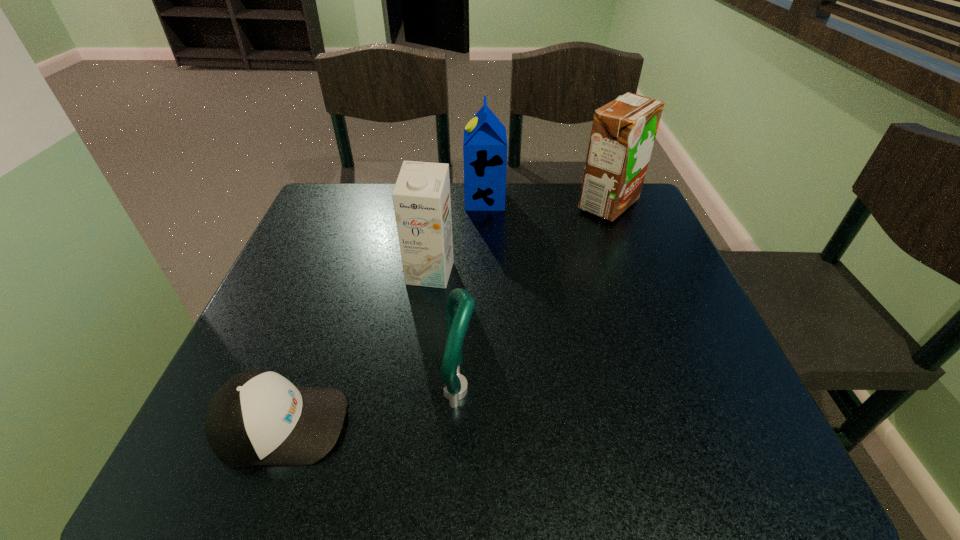
At what (x,y) coordinates should I click in order to perform the action: click on empty space between the second carton from right to left and the nearest carton. Please return your answer as a coordinate pair (x, y). The image size is (960, 540). Looking at the image, I should click on (457, 237).

Image resolution: width=960 pixels, height=540 pixels. I want to click on vacant space that is in between the leftmost object and the rightmost carton, so click(x=444, y=314).

Where is `free space that is in between the rightmost object and the cap`? The width and height of the screenshot is (960, 540). free space that is in between the rightmost object and the cap is located at coordinates (x=444, y=314).

Find the location of a particular element. This screenshot has height=540, width=960. free spot between the bottle opener and the shortest object is located at coordinates (371, 407).

The height and width of the screenshot is (540, 960). I want to click on unoccupied position between the third farthest object and the second carton from right to left, so click(x=457, y=237).

Where is `vacant point located between the bottle opener and the nearest carton`? vacant point located between the bottle opener and the nearest carton is located at coordinates (445, 332).

At what (x,y) coordinates should I click in order to perform the action: click on free space that is in between the leftmost carton and the rightmost carton. Please return your answer as a coordinate pair (x, y). The image size is (960, 540). Looking at the image, I should click on (519, 239).

At what (x,y) coordinates should I click in order to perform the action: click on unoccupied position between the second carton from left to right and the cap. Please return your answer as a coordinate pair (x, y). The image size is (960, 540). Looking at the image, I should click on (383, 312).

Find the location of a particular element. empty space between the rightmost object and the second carton from left to right is located at coordinates (546, 202).

At what (x,y) coordinates should I click in order to perform the action: click on object that can be found as the fourth closest to the cap. Please return your answer as a coordinate pair (x, y). The width and height of the screenshot is (960, 540). Looking at the image, I should click on point(623,132).